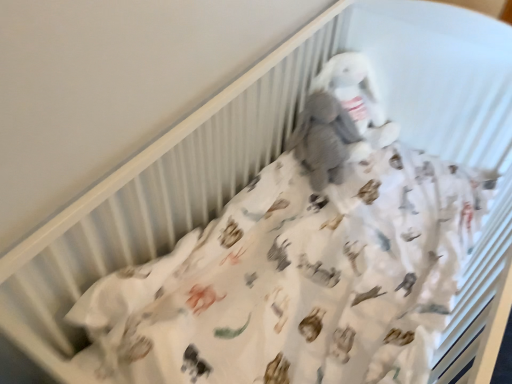
Question: Is white plush toy at center turned away from gray plush toy at upper center?

Choices:
 (A) yes
 (B) no

Answer: (B)

Question: Can you confirm if white plush toy at center is smaller than gray plush toy at upper center?

Choices:
 (A) yes
 (B) no

Answer: (B)

Question: Is white plush toy at center closer to camera compared to gray plush toy at upper center?

Choices:
 (A) no
 (B) yes

Answer: (B)

Question: From a real-world perspective, is white plush toy at center on top of gray plush toy at upper center?

Choices:
 (A) no
 (B) yes

Answer: (A)

Question: Is white plush toy at center positioned behind gray plush toy at upper center?

Choices:
 (A) no
 (B) yes

Answer: (A)

Question: Can you confirm if white plush toy at center is wider than gray plush toy at upper center?

Choices:
 (A) no
 (B) yes

Answer: (A)

Question: From a real-world perspective, is gray plush toy at upper center positioned under white plush toy at center based on gravity?

Choices:
 (A) yes
 (B) no

Answer: (B)

Question: From the image's perspective, is gray plush toy at upper center on top of white plush toy at center?

Choices:
 (A) yes
 (B) no

Answer: (A)

Question: Can you confirm if gray plush toy at upper center is positioned to the left of white plush toy at center?

Choices:
 (A) no
 (B) yes

Answer: (A)

Question: Is gray plush toy at upper center further to the viewer compared to white plush toy at center?

Choices:
 (A) yes
 (B) no

Answer: (A)

Question: Does gray plush toy at upper center have a greater width compared to white plush toy at center?

Choices:
 (A) yes
 (B) no

Answer: (A)

Question: Is gray plush toy at upper center positioned with its back to white plush toy at center?

Choices:
 (A) yes
 (B) no

Answer: (A)

Question: In the image, is white plush toy at center positioned in front of or behind gray plush toy at upper center?

Choices:
 (A) front
 (B) behind

Answer: (A)